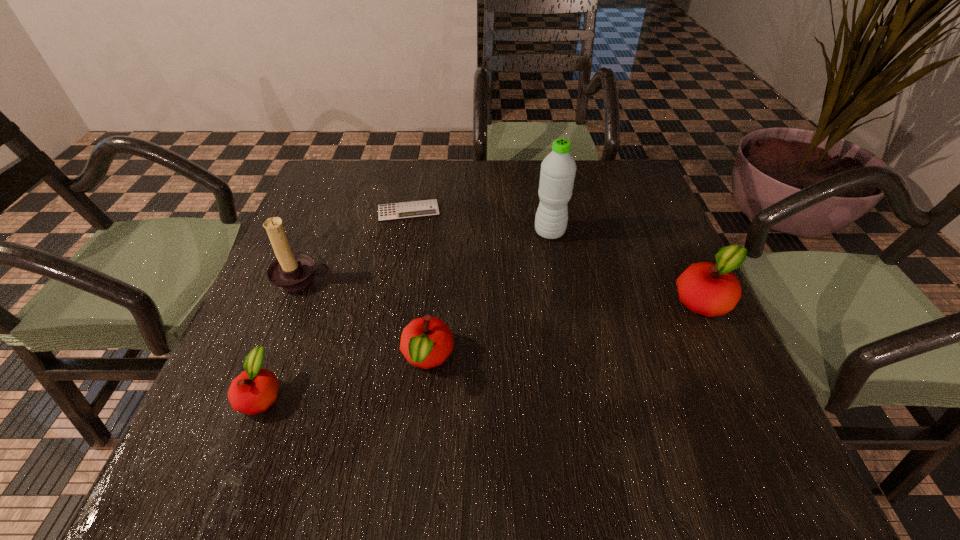
Identify the location of object that is at the right edge. (709, 289).

This screenshot has width=960, height=540. I want to click on object positioned at the near left corner, so click(x=253, y=391).

Locate an element on the screen. The width and height of the screenshot is (960, 540). vacant space at the far edge of the desktop is located at coordinates (x=524, y=163).

Where is `vacant space at the near edge of the desktop`? vacant space at the near edge of the desktop is located at coordinates (430, 386).

Locate an element on the screen. This screenshot has width=960, height=540. free region at the left edge of the desktop is located at coordinates (327, 213).

You are a GUI agent. You are given a task and a screenshot of the screen. Output one action in this format:
    pyautogui.click(x=<x>, y=<y>)
    Task: Click on the vacant space at the right edge of the desktop
    Image resolution: width=960 pixels, height=540 pixels.
    Given the screenshot: What is the action you would take?
    pyautogui.click(x=620, y=220)

Locate an element on the screen. free space at the near left corner of the desktop is located at coordinates (300, 409).

You are a GUI agent. You are given a task and a screenshot of the screen. Output one action in this format:
    pyautogui.click(x=<x>, y=<y>)
    Task: Click on the vacant space at the far right corner of the desktop
    This screenshot has width=960, height=540.
    Given the screenshot: What is the action you would take?
    pyautogui.click(x=603, y=174)

At what (x,y) coordinates should I click in order to perform the action: click on free point between the second apple from left to right and the third tallest object. Please return your answer as a coordinate pair (x, y). This screenshot has height=540, width=960. Looking at the image, I should click on point(566,329).

Identify the location of free spot between the calculator and the tallest object. (479, 222).